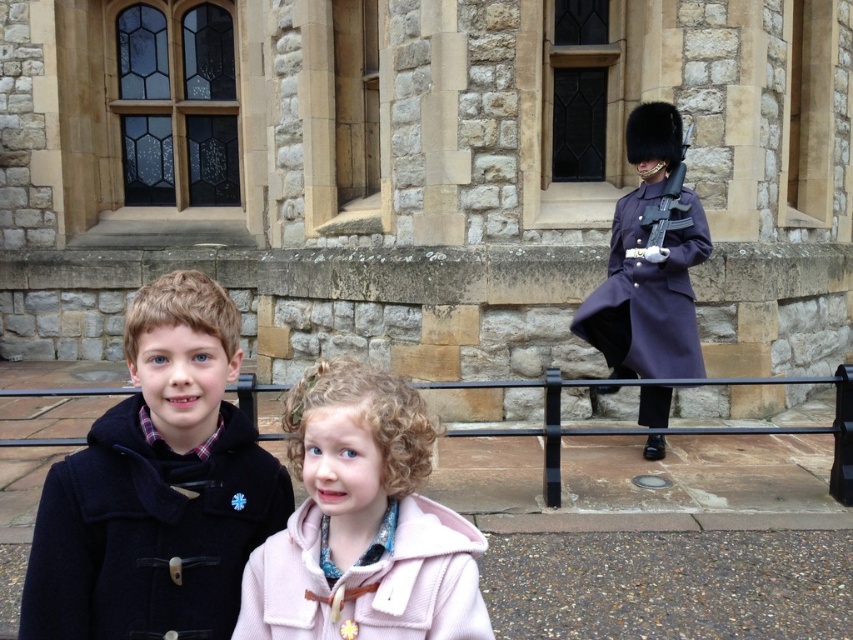
You are a photographer trying to capture a photo of the purple woolen coat at right and the black metal balustrade at lower center. Based on their positions, which object is closer to the camera?

The purple woolen coat at right is positioned over the black metal balustrade at lower center, meaning it is closer to the camera.

You are a photographer trying to capture both the dark blue wool coat at center and the pink woolen coat at lower center in a single frame. Based on their positions, which coat should you focus on first to ensure both are in the shot?

The dark blue wool coat at center is located above the pink woolen coat at lower center, so focusing on the dark blue wool coat at center first will help ensure both are within the frame.

You are a tailor who needs to determine the appropriate fabric quantity for a new coat. Observing the purple woolen coat at right and the black metal balustrade at lower center in the image, which object can help you estimate the required fabric length?

The purple woolen coat at right has a larger size compared to the black metal balustrade at lower center, so the purple woolen coat at right can help estimate the required fabric length since it is bigger and provides a better reference for the dimensions needed.